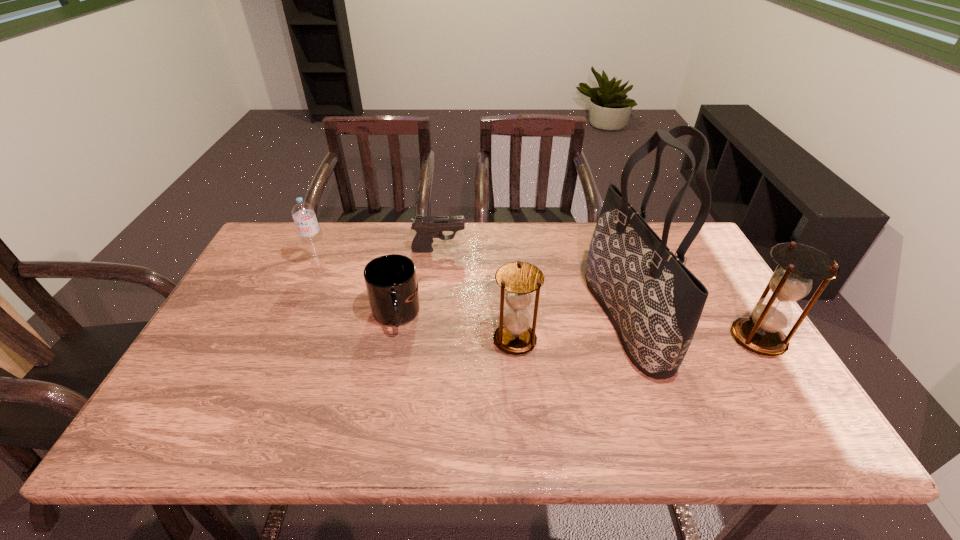
Locate which object is the fifth closest to the pistol. Please provide its 2D coordinates. Your answer should be formatted as a tuple, i.e. [(x, y)], where the tuple contains the x and y coordinates of a point satisfying the conditions above.

[(798, 264)]

Where is `object that stands as the second closest to the taller hourglass`? The image size is (960, 540). object that stands as the second closest to the taller hourglass is located at coordinates (518, 280).

The height and width of the screenshot is (540, 960). What are the coordinates of `vacant point that satisfies the following two spatial constraints: 1. with the handle on the side of the second object from right to left; 2. on the right side of the mug` in the screenshot? It's located at (395, 319).

The height and width of the screenshot is (540, 960). I want to click on free spot that satisfies the following two spatial constraints: 1. at the barrel of the pistol; 2. with the handle on the side of the mug, so click(431, 315).

This screenshot has height=540, width=960. Find the location of `vacant region that satisfies the following two spatial constraints: 1. on the back side of the tallest object; 2. at the barrel of the pistol`. vacant region that satisfies the following two spatial constraints: 1. on the back side of the tallest object; 2. at the barrel of the pistol is located at coordinates (602, 250).

The height and width of the screenshot is (540, 960). What are the coordinates of `free region that satisfies the following two spatial constraints: 1. on the front side of the water bottle; 2. on the right side of the third object from right to left` in the screenshot? It's located at (285, 340).

You are a GUI agent. You are given a task and a screenshot of the screen. Output one action in this format:
    pyautogui.click(x=<x>, y=<y>)
    Task: Click on the vacant point that satisfies the following two spatial constraints: 1. at the barrel of the pistol; 2. with the handle on the side of the mug
    The image size is (960, 540).
    Given the screenshot: What is the action you would take?
    pyautogui.click(x=431, y=315)

Where is `vacant space that satisfies the following two spatial constraints: 1. at the barrel of the farthest object; 2. with the handle on the side of the mug`? The height and width of the screenshot is (540, 960). vacant space that satisfies the following two spatial constraints: 1. at the barrel of the farthest object; 2. with the handle on the side of the mug is located at coordinates (431, 315).

Where is `vacant space that satisfies the following two spatial constraints: 1. at the barrel of the farthest object; 2. on the left side of the rightmost object`? This screenshot has height=540, width=960. vacant space that satisfies the following two spatial constraints: 1. at the barrel of the farthest object; 2. on the left side of the rightmost object is located at coordinates (428, 339).

Locate an element on the screen. Image resolution: width=960 pixels, height=540 pixels. free location that satisfies the following two spatial constraints: 1. with the handle on the side of the fifth object from left to right; 2. on the left side of the mug is located at coordinates (395, 319).